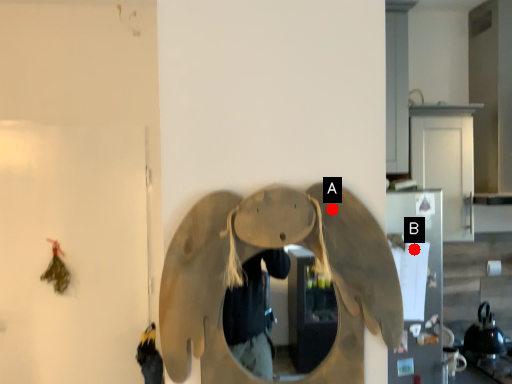
Question: Two points are circled on the image, labeled by A and B beside each circle. Among these points, which one is nearest to the camera?

Choices:
 (A) A is closer
 (B) B is closer

Answer: (A)